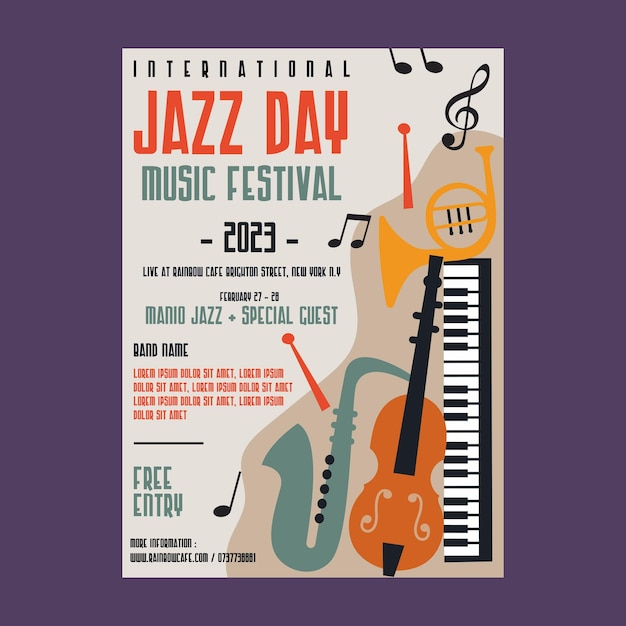
Identify the location of yellow french horn. (422, 255).